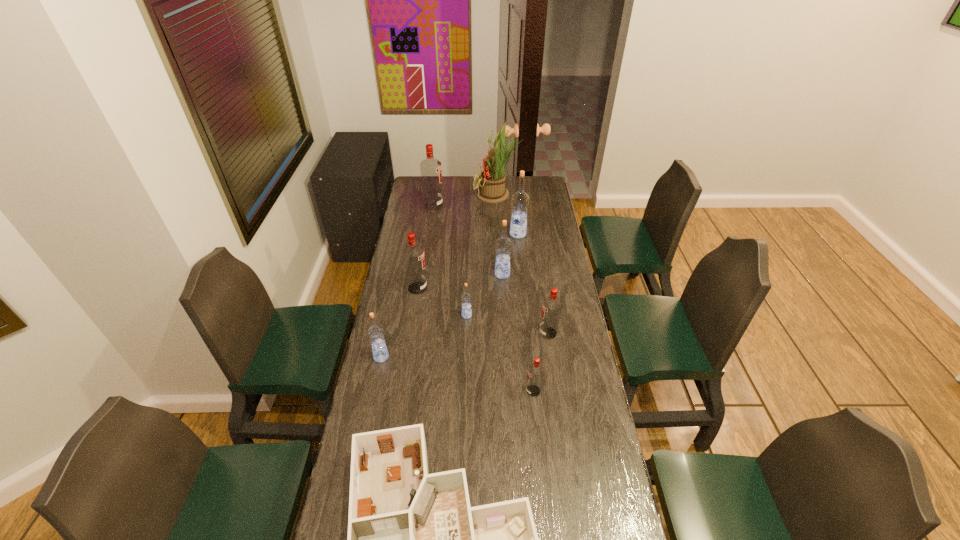
Identify which red vodka is the fourth closest to the third farthest blue vodka. Please provide its 2D coordinates. Your answer should be formatted as a tuple, i.e. [(x, y)], where the tuple contains the x and y coordinates of a point satisfying the conditions above.

[(431, 173)]

Image resolution: width=960 pixels, height=540 pixels. I want to click on the fourth closest red vodka to the seventh nearest object, so click(535, 371).

At what (x,y) coordinates should I click in order to perform the action: click on the third closest blue vodka to the ninth farthest object. Please return your answer as a coordinate pair (x, y). This screenshot has height=540, width=960. Looking at the image, I should click on (503, 245).

Locate which blue vodka ranks fourth in proximity to the flower arrangement. Please provide its 2D coordinates. Your answer should be formatted as a tuple, i.e. [(x, y)], where the tuple contains the x and y coordinates of a point satisfying the conditions above.

[(375, 333)]

At what (x,y) coordinates should I click in order to perform the action: click on free location that satisfies the following two spatial constraints: 1. on the back side of the farthest blue vodka; 2. on the front label of the farthest vodka. Please return your answer as a coordinate pair (x, y). Looking at the image, I should click on (515, 205).

Where is `blank area in the image that satisfies the following two spatial constraints: 1. on the front label of the biggest red vodka; 2. on the front side of the second nearest vodka`? blank area in the image that satisfies the following two spatial constraints: 1. on the front label of the biggest red vodka; 2. on the front side of the second nearest vodka is located at coordinates (413, 357).

Image resolution: width=960 pixels, height=540 pixels. Identify the location of free spot that satisfies the following two spatial constraints: 1. on the back side of the fourth vodka from right to left; 2. in front of the flower arrangement with the fan visible. (498, 194).